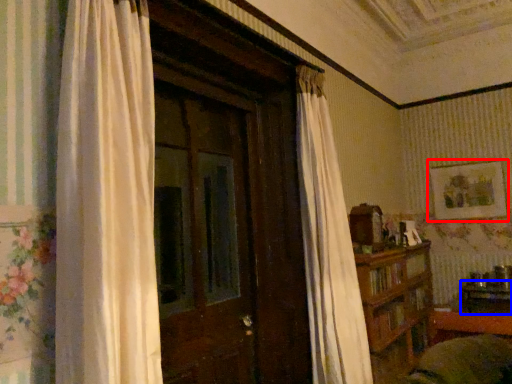
Question: Which of the following is the farthest to the observer, picture frame (highlighted by a red box) or table (highlighted by a blue box)?

Choices:
 (A) picture frame
 (B) table

Answer: (A)